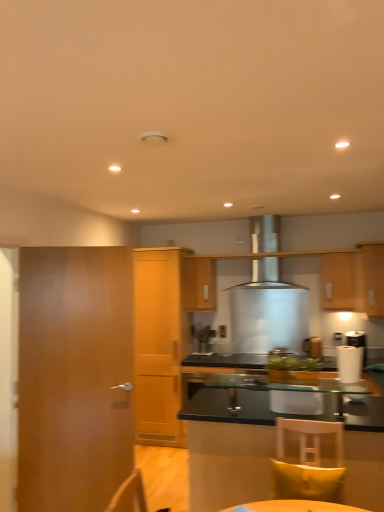
Question: Would you consider yellow fabric pillow at lower right to be distant from wooden door at left?

Choices:
 (A) no
 (B) yes

Answer: (B)

Question: Is yellow fabric pillow at lower right oriented away from wooden door at left?

Choices:
 (A) yes
 (B) no

Answer: (B)

Question: Is yellow fabric pillow at lower right at the left side of wooden door at left?

Choices:
 (A) yes
 (B) no

Answer: (B)

Question: Would you say yellow fabric pillow at lower right contains wooden door at left?

Choices:
 (A) no
 (B) yes

Answer: (A)

Question: From a real-world perspective, is yellow fabric pillow at lower right over wooden door at left?

Choices:
 (A) yes
 (B) no

Answer: (B)

Question: Considering the positions of point (269, 251) and point (220, 479), is point (269, 251) closer or farther from the camera than point (220, 479)?

Choices:
 (A) farther
 (B) closer

Answer: (A)

Question: Is satin silver range hood at center taller or shorter than transparent glass cabinet at lower right, arranged as the 1th cabinetry when viewed from the front?

Choices:
 (A) short
 (B) tall

Answer: (A)

Question: Choose the correct answer: Is satin silver range hood at center inside transparent glass cabinet at lower right, which appears as the 5th cabinetry when viewed from the back, or outside it?

Choices:
 (A) outside
 (B) inside

Answer: (A)

Question: From a real-world perspective, relative to transparent glass cabinet at lower right, arranged as the 1th cabinetry when viewed from the front, is satin silver range hood at center vertically above or below?

Choices:
 (A) below
 (B) above

Answer: (B)

Question: Considering the relative positions of transparent glass cabinet at lower right, arranged as the 1th cabinetry when viewed from the front, and satin silver coffee machine at center in the image provided, is transparent glass cabinet at lower right, arranged as the 1th cabinetry when viewed from the front, to the left or to the right of satin silver coffee machine at center?

Choices:
 (A) left
 (B) right

Answer: (B)

Question: In terms of size, does transparent glass cabinet at lower right, which appears as the 5th cabinetry when viewed from the back, appear bigger or smaller than satin silver coffee machine at center?

Choices:
 (A) big
 (B) small

Answer: (A)

Question: From a real-world perspective, relative to satin silver coffee machine at center, is transparent glass cabinet at lower right, which appears as the 5th cabinetry when viewed from the back, vertically above or below?

Choices:
 (A) below
 (B) above

Answer: (A)

Question: From the image's perspective, is transparent glass cabinet at lower right, which appears as the 5th cabinetry when viewed from the back, located above or below satin silver coffee machine at center?

Choices:
 (A) above
 (B) below

Answer: (B)

Question: Choose the correct answer: Is wooden cabinet at center, placed as the 1th cabinetry when sorted from back to front, inside satin silver range hood at center or outside it?

Choices:
 (A) outside
 (B) inside

Answer: (A)

Question: Is wooden cabinet at center, marked as the fifth cabinetry in a front-to-back arrangement, taller or shorter than satin silver range hood at center?

Choices:
 (A) short
 (B) tall

Answer: (A)